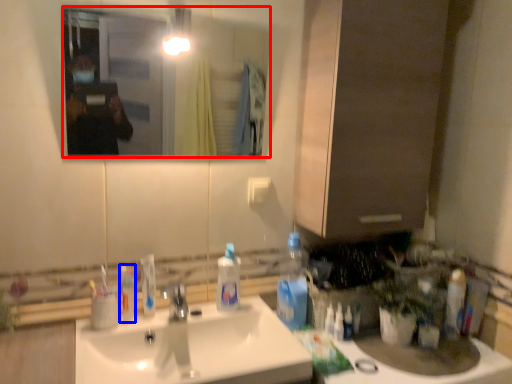
Question: Which object appears closest to the camera in this image, mirror (highlighted by a red box) or mouthwash (highlighted by a blue box)?

Choices:
 (A) mirror
 (B) mouthwash

Answer: (A)